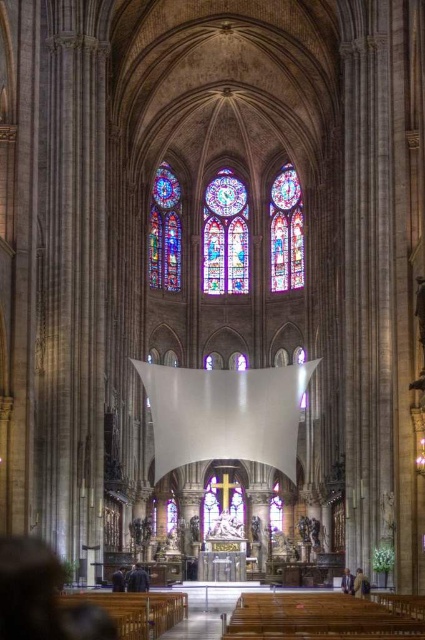
Question: Can you confirm if stained glass window at upper center is positioned above multicolored stained glass at center?

Choices:
 (A) yes
 (B) no

Answer: (B)

Question: Is stained glass window at center below multicolored stained glass at center?

Choices:
 (A) yes
 (B) no

Answer: (A)

Question: Which of the following is the closest to the observer?

Choices:
 (A) stained glass window at upper center
 (B) multicolored stained glass at center

Answer: (B)

Question: Which is nearer to the stained glass window at upper center?

Choices:
 (A) multicolored stained glass at center
 (B) stained glass window at center

Answer: (B)

Question: Can you confirm if stained glass window at upper center is smaller than multicolored stained glass at center?

Choices:
 (A) no
 (B) yes

Answer: (A)

Question: Which object is closer to the camera taking this photo?

Choices:
 (A) multicolored stained glass at center
 (B) stained glass window at upper center
 (C) stained glass window at center

Answer: (A)